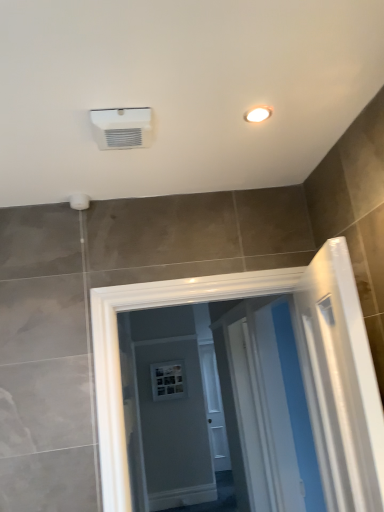
Question: Considering the relative sizes of white glossy screen door at center and white glossy light fixture at upper right in the image provided, is white glossy screen door at center bigger than white glossy light fixture at upper right?

Choices:
 (A) no
 (B) yes

Answer: (B)

Question: Considering the relative positions of white glossy screen door at center and white glossy light fixture at upper right in the image provided, is white glossy screen door at center to the right of white glossy light fixture at upper right from the viewer's perspective?

Choices:
 (A) no
 (B) yes

Answer: (B)

Question: Is white glossy screen door at center taller than white glossy light fixture at upper right?

Choices:
 (A) no
 (B) yes

Answer: (B)

Question: Is the depth of white glossy screen door at center less than that of white glossy light fixture at upper right?

Choices:
 (A) yes
 (B) no

Answer: (B)

Question: Could you tell me if white glossy screen door at center is facing white glossy light fixture at upper right?

Choices:
 (A) yes
 (B) no

Answer: (B)

Question: From the image's perspective, is white glossy screen door at center beneath white glossy light fixture at upper right?

Choices:
 (A) no
 (B) yes

Answer: (B)

Question: Is white plastic air conditioning unit at upper center surrounding white glossy screen door at center?

Choices:
 (A) yes
 (B) no

Answer: (B)

Question: Considering the relative positions of white plastic air conditioning unit at upper center and white glossy screen door at center in the image provided, is white plastic air conditioning unit at upper center to the right of white glossy screen door at center from the viewer's perspective?

Choices:
 (A) no
 (B) yes

Answer: (A)

Question: Considering the relative sizes of white plastic air conditioning unit at upper center and white glossy screen door at center in the image provided, is white plastic air conditioning unit at upper center bigger than white glossy screen door at center?

Choices:
 (A) yes
 (B) no

Answer: (B)

Question: From the image's perspective, is white plastic air conditioning unit at upper center over white glossy screen door at center?

Choices:
 (A) no
 (B) yes

Answer: (B)

Question: Is white plastic air conditioning unit at upper center thinner than white glossy screen door at center?

Choices:
 (A) yes
 (B) no

Answer: (A)

Question: From a real-world perspective, is white plastic air conditioning unit at upper center on white glossy screen door at center?

Choices:
 (A) yes
 (B) no

Answer: (A)

Question: Does white glossy light fixture at upper right lie in front of white glossy screen door at center?

Choices:
 (A) no
 (B) yes

Answer: (B)